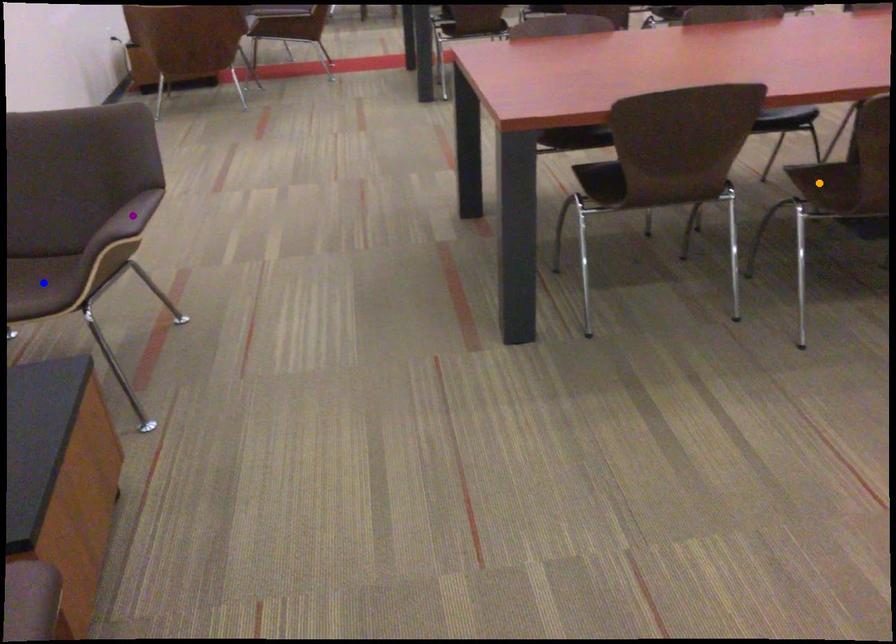
Order these from nearest to farthest:
A) orange point
B) blue point
C) purple point

orange point
blue point
purple point